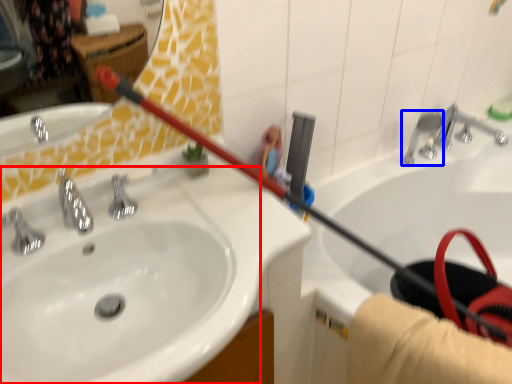
Question: Which object appears closest to the camera in this image, sink (highlighted by a red box) or plumbing fixture (highlighted by a blue box)?

Choices:
 (A) sink
 (B) plumbing fixture

Answer: (A)